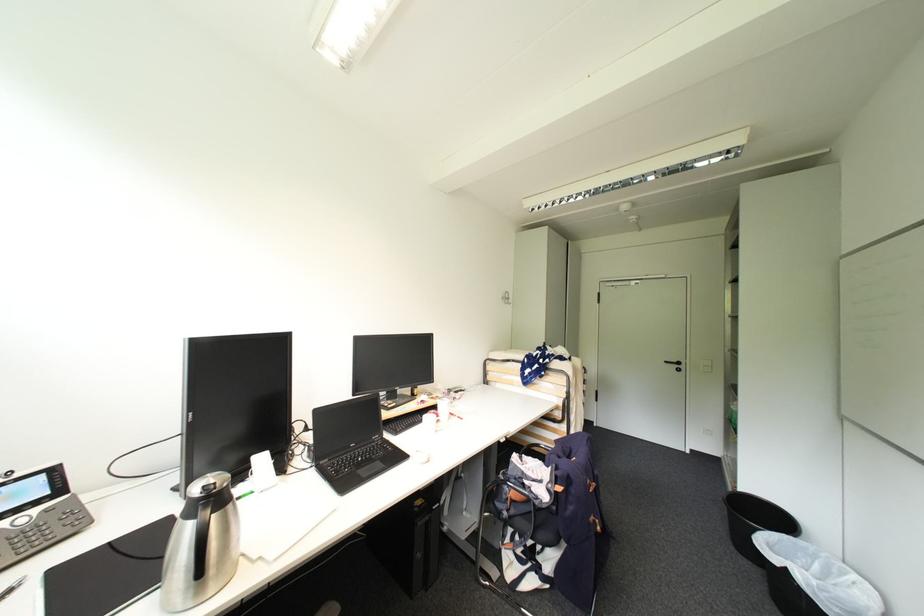
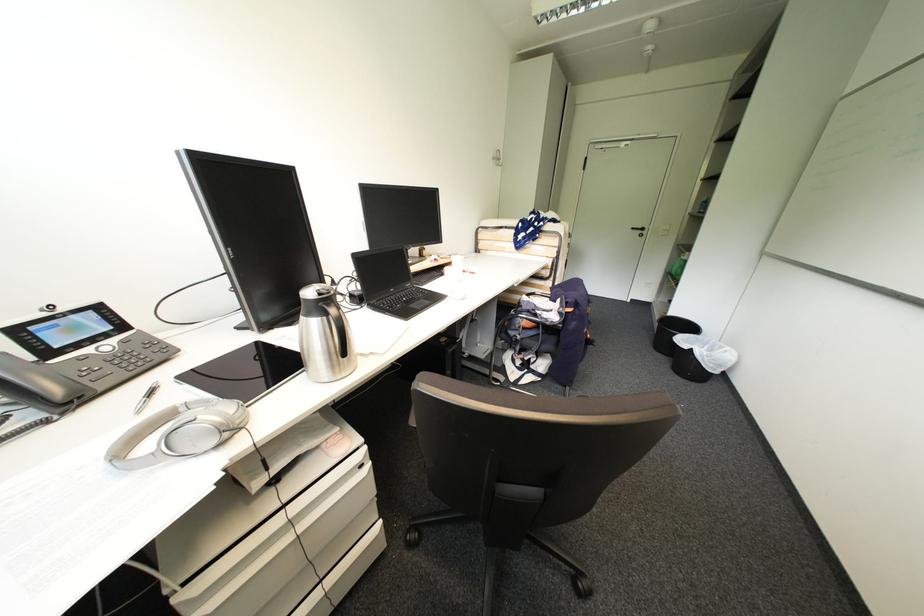
In the second image, find the point that corresponds to the point at 213,507 in the first image.

(334, 306)